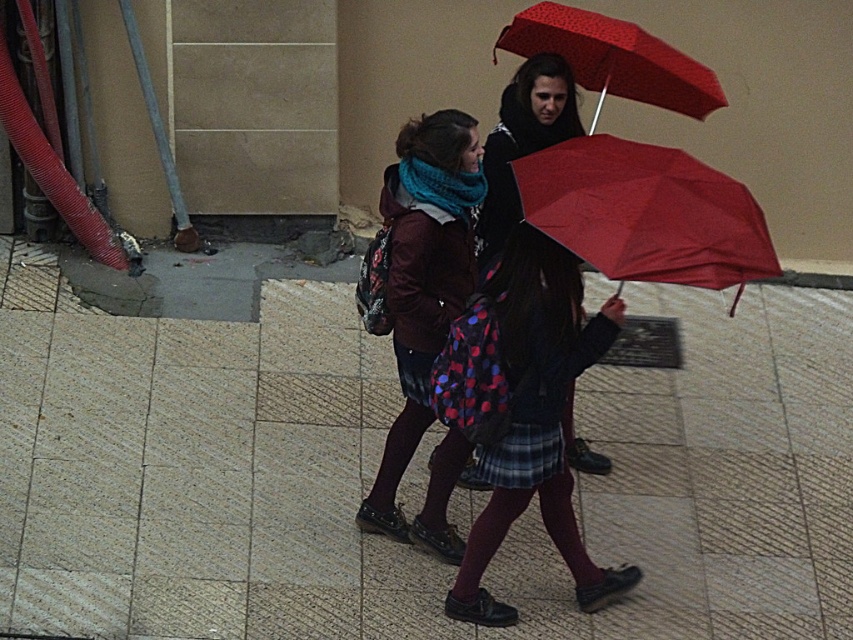
Question: Which of the following is the closest to the observer?

Choices:
 (A) smooth concrete pavement at center
 (B) matte black jacket at center
 (C) matte red umbrella at center

Answer: (C)

Question: Can you confirm if matte red umbrella at center is bigger than matte black coat at center?

Choices:
 (A) yes
 (B) no

Answer: (A)

Question: Which point appears farthest from the camera in this image?

Choices:
 (A) (335, 579)
 (B) (550, 448)
 (C) (445, 136)

Answer: (A)

Question: Is smooth concrete pavement at center behind polka dot fabric dress at center?

Choices:
 (A) no
 (B) yes

Answer: (B)

Question: Which object appears closest to the camera in this image?

Choices:
 (A) polka dot fabric dress at center
 (B) smooth concrete pavement at center
 (C) matte black jacket at center
 (D) red dotted umbrella at upper center

Answer: (A)

Question: Does polka dot fabric dress at center have a greater width compared to matte black coat at center?

Choices:
 (A) yes
 (B) no

Answer: (A)